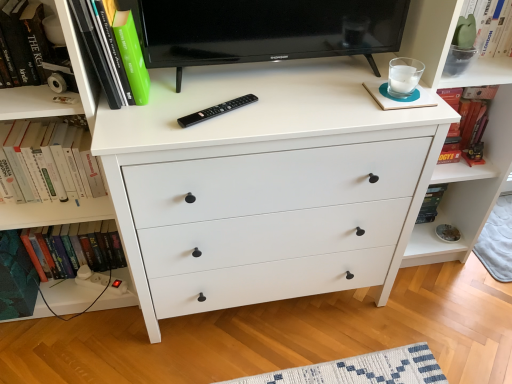
Question: From a real-world perspective, is green matte book at upper left, which appears as the third book when ordered from the bottom, physically above green matte plant at upper right?

Choices:
 (A) yes
 (B) no

Answer: (A)

Question: Can you confirm if green matte book at upper left, the first book from the top, is shorter than green matte plant at upper right?

Choices:
 (A) no
 (B) yes

Answer: (A)

Question: From the image's perspective, is green matte book at upper left, the first book from the top, beneath green matte plant at upper right?

Choices:
 (A) yes
 (B) no

Answer: (A)

Question: Does green matte book at upper left, the first book from the top, have a smaller size compared to green matte plant at upper right?

Choices:
 (A) no
 (B) yes

Answer: (A)

Question: Is green matte book at upper left, the first book from the top, at the right side of green matte plant at upper right?

Choices:
 (A) yes
 (B) no

Answer: (B)

Question: Is white plastic plug at lower left taller or shorter than hardcover book at left, which is the first book from bottom to top?

Choices:
 (A) tall
 (B) short

Answer: (B)

Question: Is white plastic plug at lower left inside the boundaries of hardcover book at left, which is the first book from bottom to top, or outside?

Choices:
 (A) inside
 (B) outside

Answer: (B)

Question: From the image's perspective, relative to hardcover book at left, which is the first book from bottom to top, is white plastic plug at lower left above or below?

Choices:
 (A) above
 (B) below

Answer: (B)

Question: Is white plastic plug at lower left bigger or smaller than hardcover book at left, which is the third book from top to bottom?

Choices:
 (A) small
 (B) big

Answer: (A)

Question: From the image's perspective, is hardcover book at left, which is counted as the second book, starting from the bottom, above or below teal matte book at left?

Choices:
 (A) below
 (B) above

Answer: (B)

Question: Is hardcover book at left, which is counted as the second book, starting from the bottom, inside or outside of teal matte book at left?

Choices:
 (A) outside
 (B) inside

Answer: (A)

Question: Considering the positions of hardcover book at left, which is counted as the second book, starting from the bottom, and teal matte book at left in the image, is hardcover book at left, which is counted as the second book, starting from the bottom, bigger or smaller than teal matte book at left?

Choices:
 (A) small
 (B) big

Answer: (B)

Question: Visually, is hardcover book at left, which is counted as the second book, starting from the bottom, positioned to the left or to the right of teal matte book at left?

Choices:
 (A) right
 (B) left

Answer: (A)

Question: From a real-world perspective, is green matte plant at upper right physically located above or below hardcover book at left, which is counted as the second book, starting from the bottom?

Choices:
 (A) above
 (B) below

Answer: (A)

Question: Considering their positions, is green matte plant at upper right located in front of or behind hardcover book at left, acting as the second book starting from the top?

Choices:
 (A) front
 (B) behind

Answer: (B)